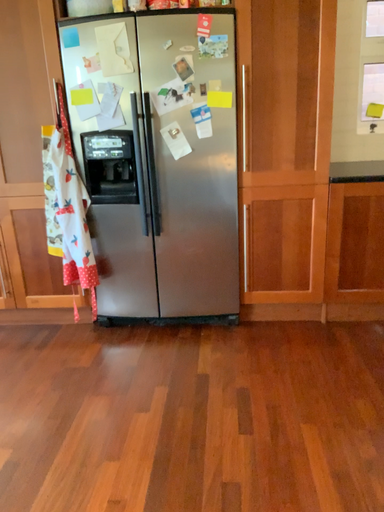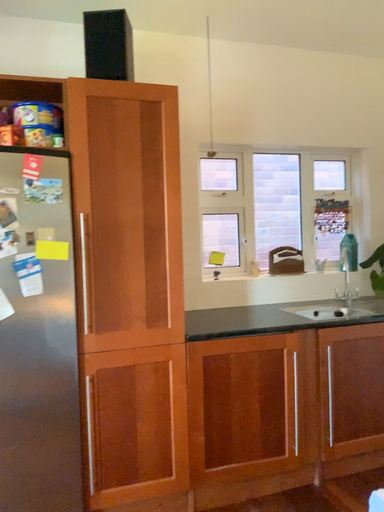
Question: Which way did the camera rotate in the video?

Choices:
 (A) rotated upward
 (B) rotated downward

Answer: (A)